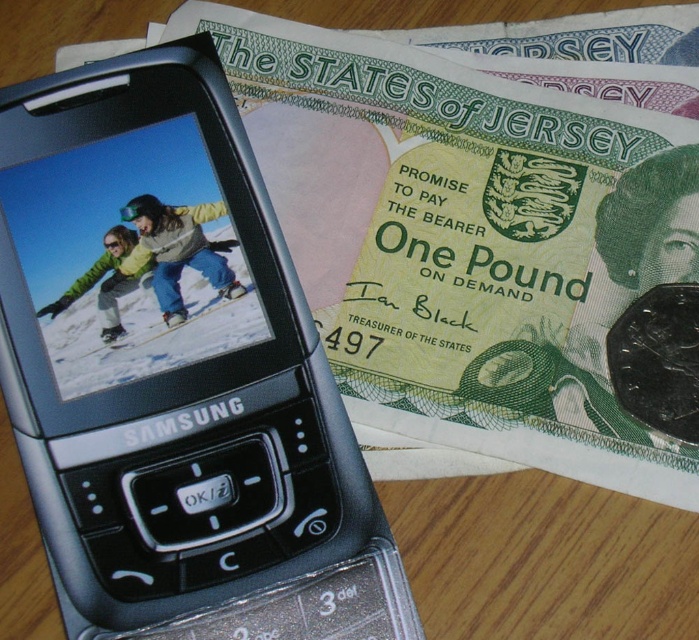
Question: Which point is farther to the camera?

Choices:
 (A) (233, 381)
 (B) (222, 257)

Answer: (B)

Question: Is black plastic samsung phone at upper left below matte yellow snowboarder at center?

Choices:
 (A) no
 (B) yes

Answer: (B)

Question: Which object is closer to the camera taking this photo?

Choices:
 (A) matte yellow snowboarder at center
 (B) black plastic samsung phone at upper left

Answer: (B)

Question: Does black plastic samsung phone at upper left have a smaller size compared to matte yellow snowboarder at center?

Choices:
 (A) no
 (B) yes

Answer: (A)

Question: Does black plastic samsung phone at upper left have a larger size compared to matte yellow snowboarder at center?

Choices:
 (A) no
 (B) yes

Answer: (B)